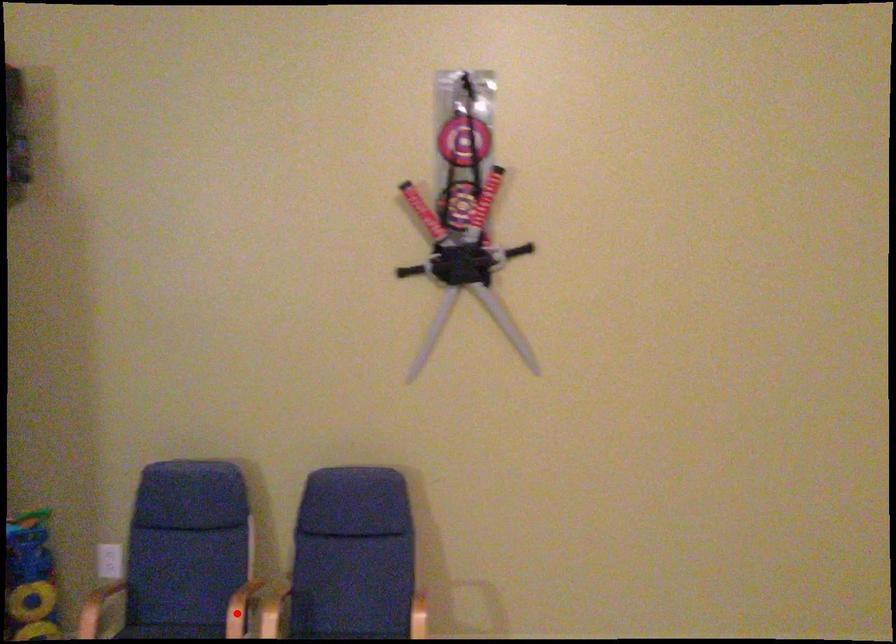
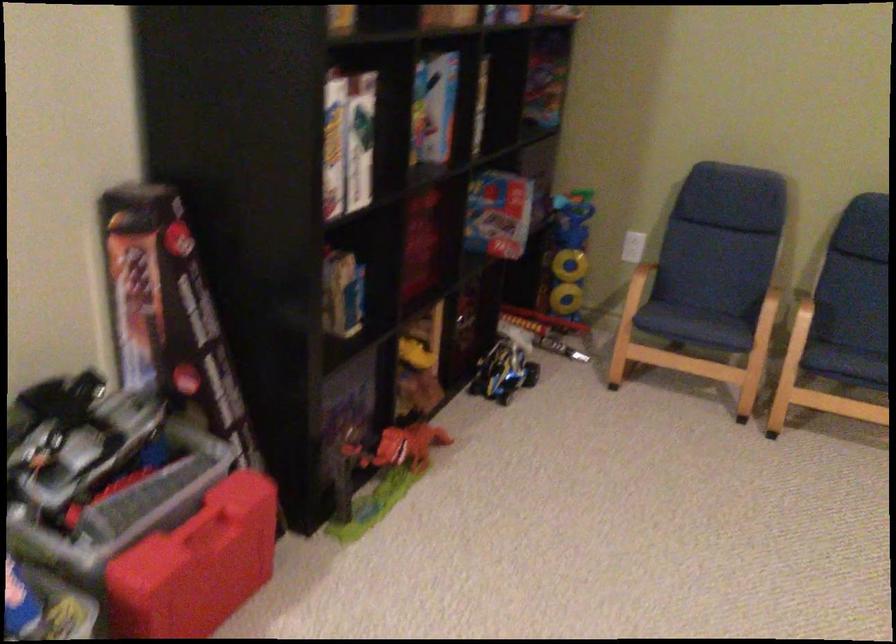
Question: I am providing you with two images of the same scene from different viewpoints. A red point is marked on the first image. Can you still see the location of the red point in image 2?

Choices:
 (A) Yes
 (B) No

Answer: (B)